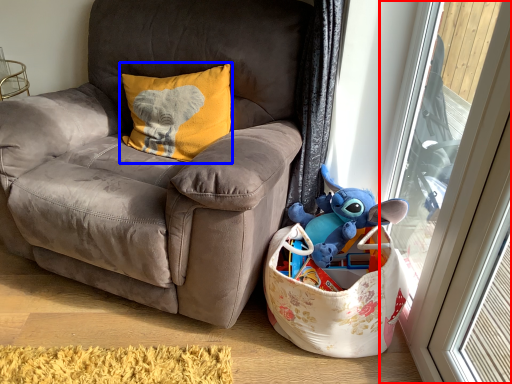
Question: Which object is further to the camera taking this photo, glass door (highlighted by a red box) or pillow (highlighted by a blue box)?

Choices:
 (A) glass door
 (B) pillow

Answer: (B)